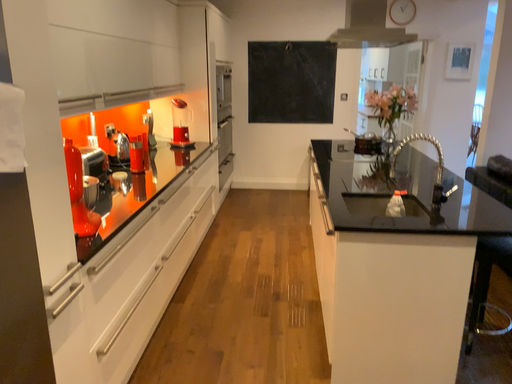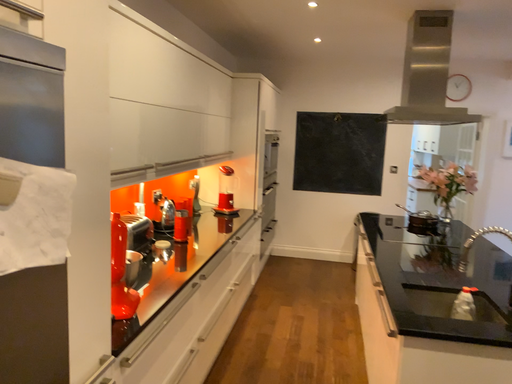
Question: How did the camera likely rotate when shooting the video?

Choices:
 (A) rotated upward
 (B) rotated downward

Answer: (A)